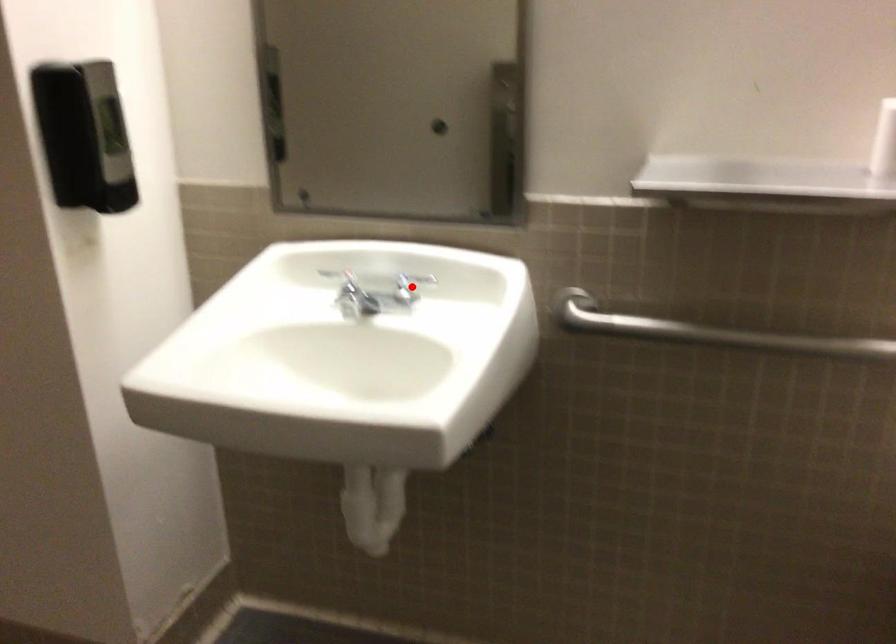
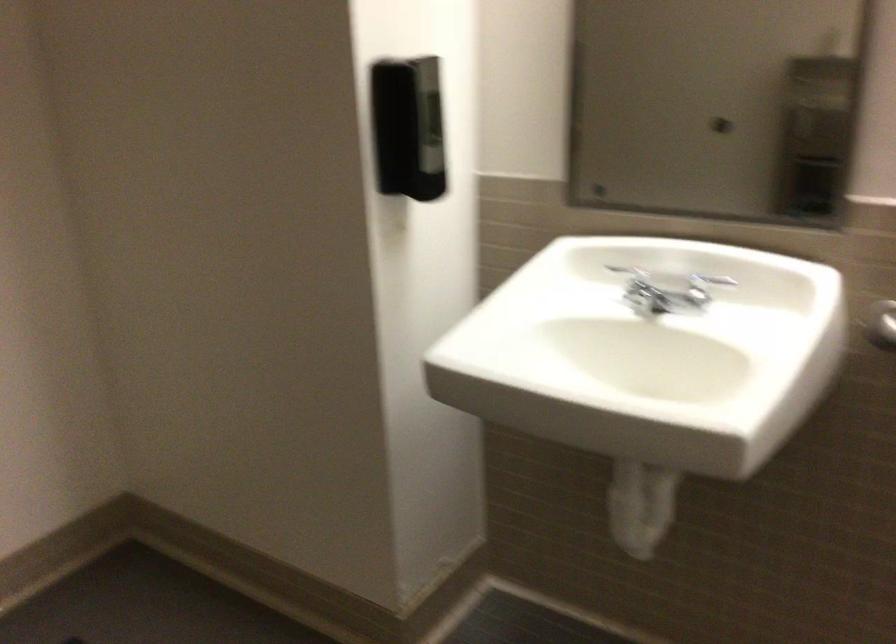
The point at the highlighted location is marked in the first image. Where is the corresponding point in the second image?

(704, 287)